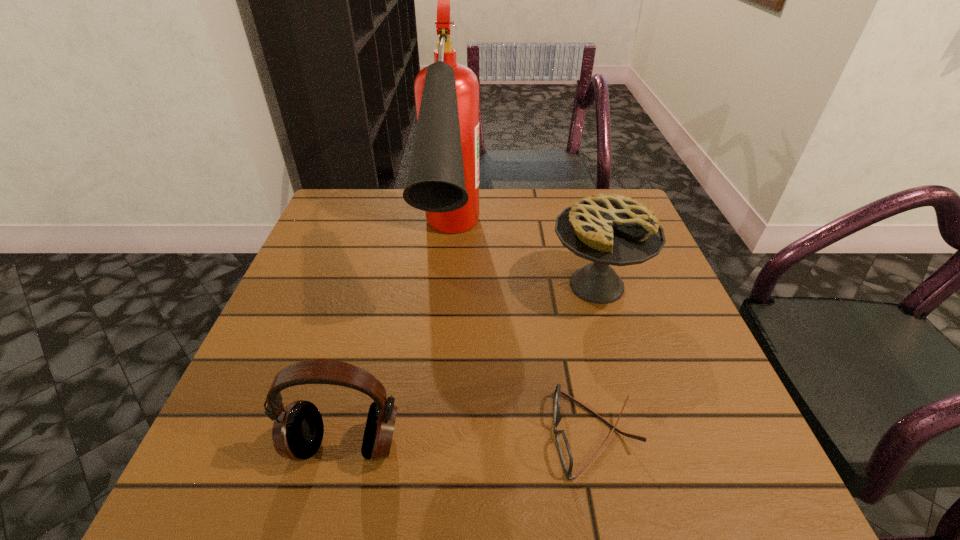
What are the coordinates of `the tallest object` in the screenshot? It's located at (x=443, y=180).

Image resolution: width=960 pixels, height=540 pixels. In order to click on pie in this screenshot , I will do `click(608, 229)`.

This screenshot has height=540, width=960. Find the location of `headset`. headset is located at coordinates (297, 433).

At what (x,y) coordinates should I click in order to perform the action: click on the shortest object. Please return your answer as a coordinate pair (x, y). This screenshot has height=540, width=960. Looking at the image, I should click on (564, 450).

Identify the location of free space located 0.090m at the nozzle of the fire extinguisher. Image resolution: width=960 pixels, height=540 pixels. (441, 364).

I want to click on vacant position located 0.330m on the cut side of the pie, so click(656, 486).

Where is `vacant space located on the front-facing side of the shortest object`? vacant space located on the front-facing side of the shortest object is located at coordinates 472,434.

You are a GUI agent. You are given a task and a screenshot of the screen. Output one action in this format:
    pyautogui.click(x=<x>, y=<y>)
    Task: Click on the vacant space located on the front-facing side of the shortest object
    This screenshot has width=960, height=540.
    Given the screenshot: What is the action you would take?
    pyautogui.click(x=410, y=434)

At what (x,y) coordinates should I click in order to perform the action: click on free space located 0.140m on the front-facing side of the shortest object. Please return your answer as a coordinate pair (x, y). The width and height of the screenshot is (960, 540). Looking at the image, I should click on (466, 434).

What are the coordinates of `object present at the far edge` in the screenshot? It's located at (443, 180).